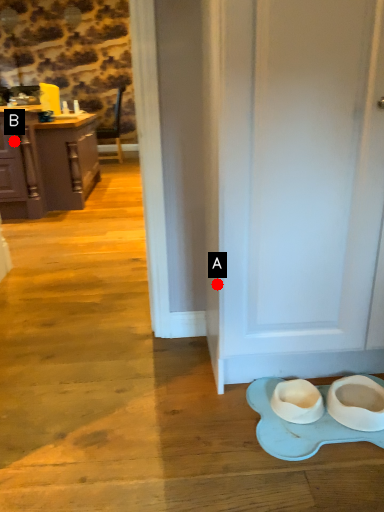
Question: Two points are circled on the image, labeled by A and B beside each circle. Which point appears closest to the camera in this image?

Choices:
 (A) A is closer
 (B) B is closer

Answer: (A)